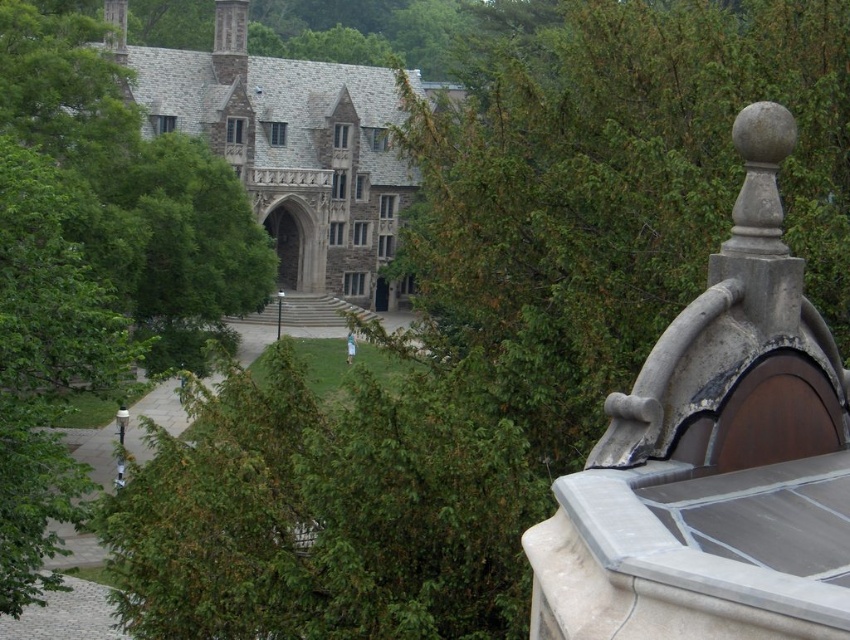
Looking at this image, does green leafy tree at center appear under gray stone church at upper left?

Correct, green leafy tree at center is located below gray stone church at upper left.

Which is in front, point (43, 216) or point (327, 77)?

Positioned in front is point (43, 216).

Which is behind, point (129, 189) or point (374, 220)?

Positioned behind is point (374, 220).

Locate an element on the screen. This screenshot has height=640, width=850. green leafy tree at center is located at coordinates (91, 260).

Is green leafy tree at upper center behind gray stone church at upper left?

No, it is in front of gray stone church at upper left.

Between green leafy tree at upper center and gray stone church at upper left, which one appears on the left side from the viewer's perspective?

gray stone church at upper left is more to the left.

Does point (842, 148) lie in front of point (335, 230)?

Yes, it is in front of point (335, 230).

Where is `green leafy tree at upper center`? green leafy tree at upper center is located at coordinates (615, 195).

Which is below, green leafy tree at upper center or green leafy tree at center?

green leafy tree at center is below.

Who is positioned more to the left, green leafy tree at upper center or green leafy tree at center?

green leafy tree at center is more to the left.

At what (x,y) coordinates should I click in order to perform the action: click on green leafy tree at upper center. Please return your answer as a coordinate pair (x, y). This screenshot has width=850, height=640. Looking at the image, I should click on (615, 195).